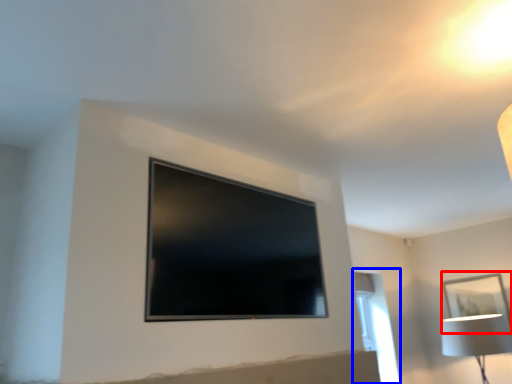
Question: Which object appears farthest to the camera in this image, picture frame (highlighted by a red box) or window (highlighted by a blue box)?

Choices:
 (A) picture frame
 (B) window

Answer: (A)